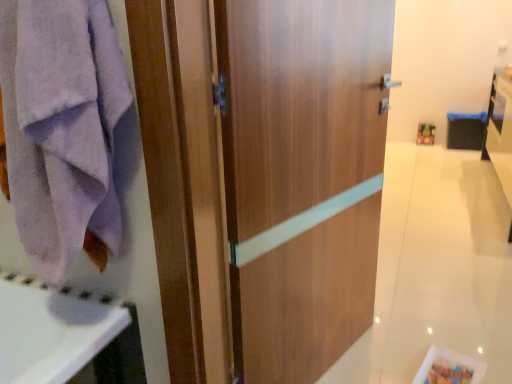
Question: Is wooden door at center in front of or behind lavender cotton towel at left in the image?

Choices:
 (A) front
 (B) behind

Answer: (A)

Question: Is wooden door at center taller or shorter than lavender cotton towel at left?

Choices:
 (A) tall
 (B) short

Answer: (A)

Question: Which object is the farthest from the lavender cotton towel at left?

Choices:
 (A) white glossy vanity at right
 (B) wooden door at center

Answer: (A)

Question: Considering the real-world distances, which object is farthest from the lavender cotton towel at left?

Choices:
 (A) white glossy vanity at right
 (B) wooden door at center

Answer: (A)